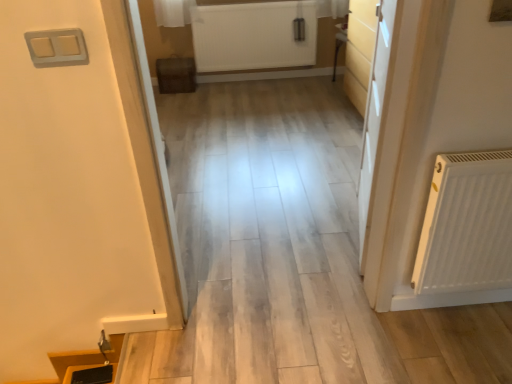
The width and height of the screenshot is (512, 384). What do you see at coordinates (374, 119) in the screenshot? I see `light wood door at right` at bounding box center [374, 119].

Where is `light wood door at right`? light wood door at right is located at coordinates (374, 119).

Find the location of `white matte radiator at upper center`. white matte radiator at upper center is located at coordinates click(x=253, y=36).

The image size is (512, 384). What do you see at coordinates (253, 36) in the screenshot? I see `white matte radiator at upper center` at bounding box center [253, 36].

You are a GUI agent. You are given a task and a screenshot of the screen. Output one action in this format:
    pyautogui.click(x=<x>, y=<y>)
    Task: Click on the light wood door at right
    
    Given the screenshot: What is the action you would take?
    pyautogui.click(x=374, y=119)

Which object is positioned more to the right, white matte radiator at upper center or light wood door at right?

light wood door at right.

Is the depth of white matte radiator at upper center greater than that of light wood door at right?

Yes, the depth of white matte radiator at upper center is greater than that of light wood door at right.

Does point (278, 17) appear closer or farther from the camera than point (360, 202)?

Point (278, 17) is positioned farther from the camera compared to point (360, 202).

From the image's perspective, would you say white matte radiator at upper center is shown under light wood door at right?

No, from the image's perspective, white matte radiator at upper center is not beneath light wood door at right.

From a real-world perspective, is white matte radiator at upper center physically located above or below light wood door at right?

In terms of real-world spatial position, white matte radiator at upper center is below light wood door at right.

Considering the sizes of white matte radiator at upper center and light wood door at right in the image, is white matte radiator at upper center wider or thinner than light wood door at right?

In the image, white matte radiator at upper center appears to be more narrow than light wood door at right.

Considering the sizes of objects white matte radiator at upper center and light wood door at right in the image provided, who is shorter, white matte radiator at upper center or light wood door at right?

With less height is white matte radiator at upper center.

Is white matte radiator at upper center smaller than light wood door at right?

Yes, white matte radiator at upper center is smaller than light wood door at right.

Is light wood door at right surrounded by white matte radiator at upper center?

No, white matte radiator at upper center does not contain light wood door at right.

Does white matte radiator at upper center touch light wood door at right?

white matte radiator at upper center and light wood door at right are clearly separated.

Is white matte radiator at upper center looking in the opposite direction of light wood door at right?

No, light wood door at right is not at the back of white matte radiator at upper center.

Can you tell me how much white matte radiator at upper center and light wood door at right differ in facing direction?

They differ by 104 degrees in their facing directions.

Locate an element on the screen. Image resolution: width=512 pixels, height=384 pixels. radiator above the light wood door at right (from the image's perspective) is located at coordinates (253, 36).

Which is more to the right, light wood door at right or white matte radiator at upper center?

From the viewer's perspective, light wood door at right appears more on the right side.

Is light wood door at right in front of or behind white matte radiator at upper center in the image?

Visually, light wood door at right is located in front of white matte radiator at upper center.

Considering the points (368, 184) and (270, 49), which point is in front, point (368, 184) or point (270, 49)?

The point (368, 184) is more forward.

From the image's perspective, between light wood door at right and white matte radiator at upper center, who is located below?

light wood door at right, from the image's perspective.

From a real-world perspective, which is physically above, light wood door at right or white matte radiator at upper center?

From a 3D spatial view, light wood door at right is above.

Considering the sizes of light wood door at right and white matte radiator at upper center in the image, is light wood door at right wider or thinner than white matte radiator at upper center?

In the image, light wood door at right appears to be wider than white matte radiator at upper center.

Considering the sizes of objects light wood door at right and white matte radiator at upper center in the image provided, who is shorter, light wood door at right or white matte radiator at upper center?

Standing shorter between the two is white matte radiator at upper center.

Is light wood door at right bigger or smaller than white matte radiator at upper center?

In the image, light wood door at right appears to be larger than white matte radiator at upper center.

Would you say white matte radiator at upper center is part of light wood door at right's contents?

No, white matte radiator at upper center is located outside of light wood door at right.

Is light wood door at right with white matte radiator at upper center?

No, light wood door at right is not with white matte radiator at upper center.

Is light wood door at right aimed at white matte radiator at upper center?

No, light wood door at right does not turn towards white matte radiator at upper center.

Consider the image. How much distance is there between light wood door at right and white matte radiator at upper center?

light wood door at right and white matte radiator at upper center are 7.36 feet apart from each other.

This screenshot has height=384, width=512. What are the coordinates of `radiator above the light wood door at right (from the image's perspective)` in the screenshot? It's located at (253, 36).

I want to click on radiator that appears on the left of light wood door at right, so click(x=253, y=36).

Find the location of a particular element. This screenshot has width=512, height=384. door on the right of white matte radiator at upper center is located at coordinates (374, 119).